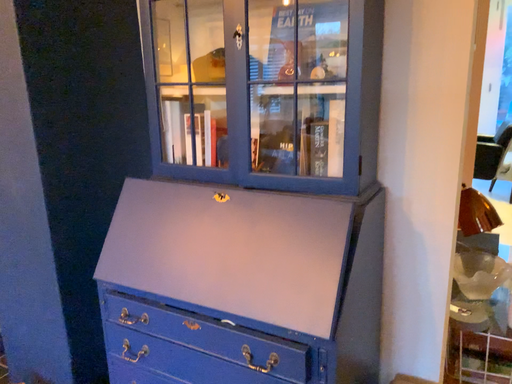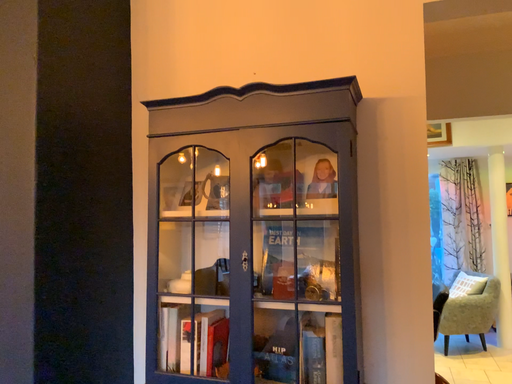
Question: Which way did the camera rotate in the video?

Choices:
 (A) rotated upward
 (B) rotated downward

Answer: (A)